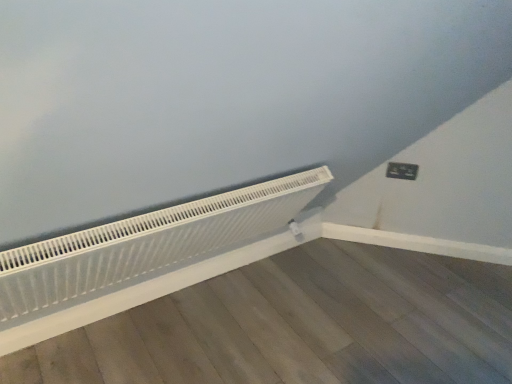
This screenshot has width=512, height=384. What are the coordinates of `free point below white matte radiator at lower left (from a real-world perspective)` in the screenshot? It's located at (184, 286).